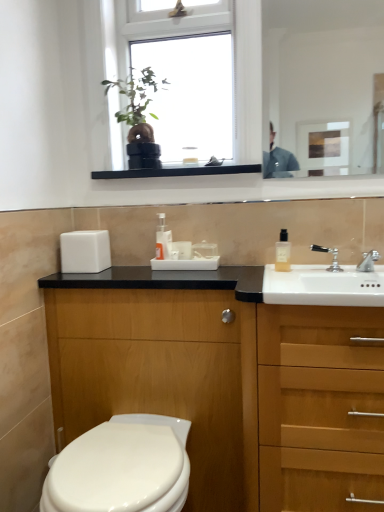
The height and width of the screenshot is (512, 384). In order to click on unoccupied space behind silver metallic faucet at right, the 1th tap viewed from the right in this screenshot , I will do `click(350, 270)`.